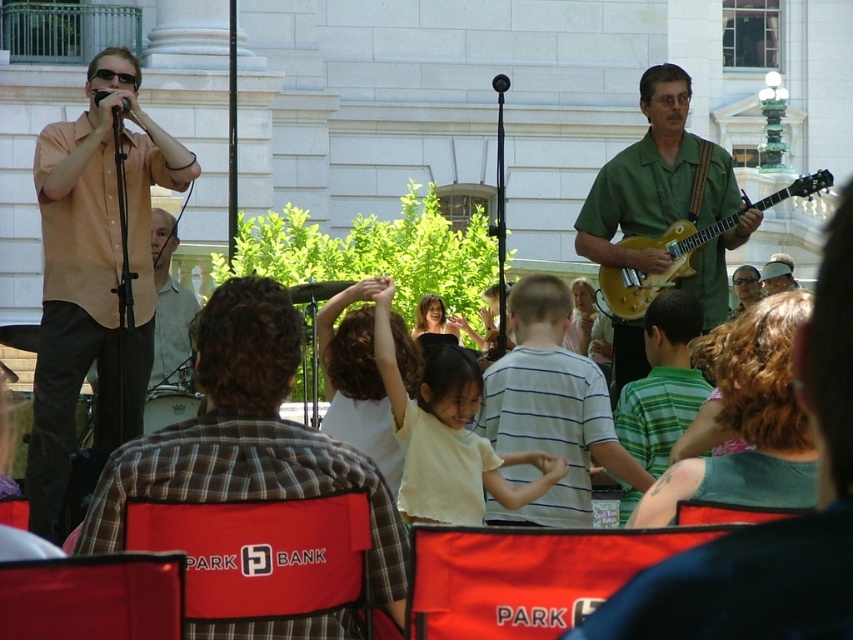
Question: Is plaid shirt at center in front of white striped shirt at center?

Choices:
 (A) yes
 (B) no

Answer: (A)

Question: Which point is closer to the camera taking this photo?

Choices:
 (A) (556, 513)
 (B) (717, 220)
 (C) (430, 516)
 (D) (762, 424)

Answer: (D)

Question: In this image, where is plaid shirt at center located relative to green striped shirt at center?

Choices:
 (A) right
 (B) left

Answer: (B)

Question: Does plaid shirt at center have a greater width compared to white striped shirt at center?

Choices:
 (A) no
 (B) yes

Answer: (B)

Question: Which object is positioned farthest from the green matte guitar at center?

Choices:
 (A) matte green shirt at center
 (B) green striped shirt at center
 (C) smooth black hair at center

Answer: (A)

Question: Which is nearer to the white striped shirt at center?

Choices:
 (A) green striped shirt at center
 (B) matte green shirt at center

Answer: (A)